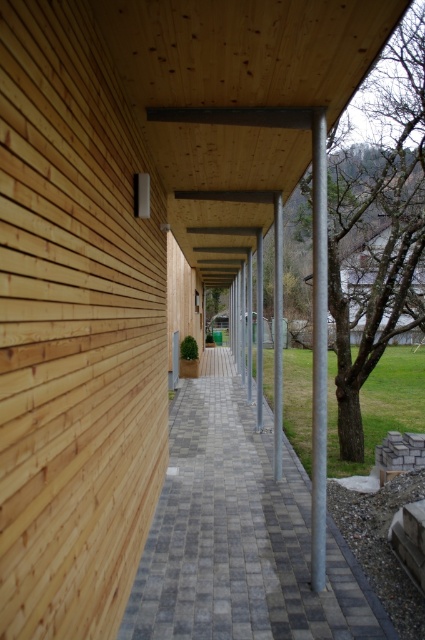
Question: Is gray checkered paving at center smaller than galvanized metal pole at center?

Choices:
 (A) yes
 (B) no

Answer: (B)

Question: Which point is farther to the camera?

Choices:
 (A) galvanized metal pole at center
 (B) gray checkered paving at center

Answer: (A)

Question: Can you confirm if gray checkered paving at center is positioned to the right of galvanized metal pole at center?

Choices:
 (A) yes
 (B) no

Answer: (B)

Question: Is gray checkered paving at center bigger than galvanized metal pole at center?

Choices:
 (A) no
 (B) yes

Answer: (B)